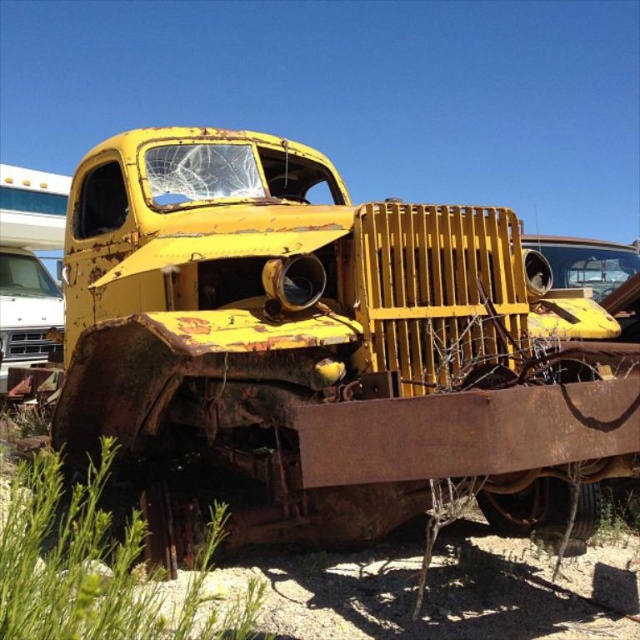
Looking at this image, you are standing in the junkyard and want to take a photo of both the rusty yellow truck at center and the rusty metal truck at center. Which truck should you focus on first if you want to capture both in your camera frame?

The rusty yellow truck at center is located below the rusty metal truck at center, so you should focus on the rusty metal truck at center first to ensure both are in the frame.

You are a mechanic standing at the edge of the junkyard, and you need to assess the distance between the two trucks. Which truck is closer to you, the rusty yellow truck at center or the rusty metal truck at center?

Both trucks are at the center, so they are the same distance from you. However, according to the description, the rusty yellow truck at center is 12.67 feet away from the rusty metal truck at center, meaning they are positioned at the same central area but separated by that distance. Since you are at the edge, both are equally distant unless one is closer to the edge, but the scene doesn t specify that. Therefore, the distance between them is 12.67 feet, but their positions relative to you aren t detailed.

You are standing in front of a junkyard and see two trucks at the center. Which truck is closer to you, the rusty yellow truck at center or the rusty metal truck at center?

The rusty yellow truck at center is closer to the viewer than the rusty metal truck at center.